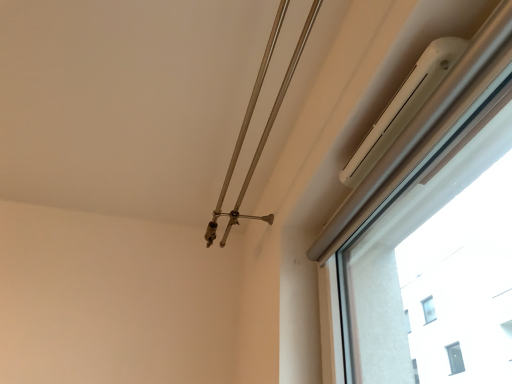
Question: Should I look upward or downward to see white plastic air conditioner at upper right?

Choices:
 (A) up
 (B) down

Answer: (A)

Question: Is white plastic air conditioner at upper right shorter than metallic silver rod at upper center?

Choices:
 (A) no
 (B) yes

Answer: (B)

Question: Is white plastic air conditioner at upper right facing away from metallic silver rod at upper center?

Choices:
 (A) yes
 (B) no

Answer: (B)

Question: From the image's perspective, is white plastic air conditioner at upper right below metallic silver rod at upper center?

Choices:
 (A) no
 (B) yes

Answer: (A)

Question: Would you say metallic silver rod at upper center is part of white plastic air conditioner at upper right's contents?

Choices:
 (A) yes
 (B) no

Answer: (B)

Question: Is white plastic air conditioner at upper right not within metallic silver rod at upper center?

Choices:
 (A) yes
 (B) no

Answer: (A)

Question: Could you tell me if white plastic air conditioner at upper right is turned towards metallic silver rod at upper center?

Choices:
 (A) no
 (B) yes

Answer: (A)

Question: Does metallic silver rod at upper center turn towards white plastic air conditioner at upper right?

Choices:
 (A) no
 (B) yes

Answer: (A)

Question: Can you confirm if metallic silver rod at upper center is positioned to the left of white plastic air conditioner at upper right?

Choices:
 (A) no
 (B) yes

Answer: (B)

Question: Considering the relative sizes of metallic silver rod at upper center and white plastic air conditioner at upper right in the image provided, is metallic silver rod at upper center taller than white plastic air conditioner at upper right?

Choices:
 (A) no
 (B) yes

Answer: (B)

Question: Considering the relative positions of metallic silver rod at upper center and white plastic air conditioner at upper right in the image provided, is metallic silver rod at upper center to the right of white plastic air conditioner at upper right from the viewer's perspective?

Choices:
 (A) yes
 (B) no

Answer: (B)

Question: Can you confirm if metallic silver rod at upper center is thinner than white plastic air conditioner at upper right?

Choices:
 (A) no
 (B) yes

Answer: (A)

Question: From the image's perspective, is metallic silver rod at upper center located beneath white plastic air conditioner at upper right?

Choices:
 (A) no
 (B) yes

Answer: (B)

Question: Considering their positions, is metallic silver rod at upper center located in front of or behind white plastic air conditioner at upper right?

Choices:
 (A) behind
 (B) front

Answer: (A)